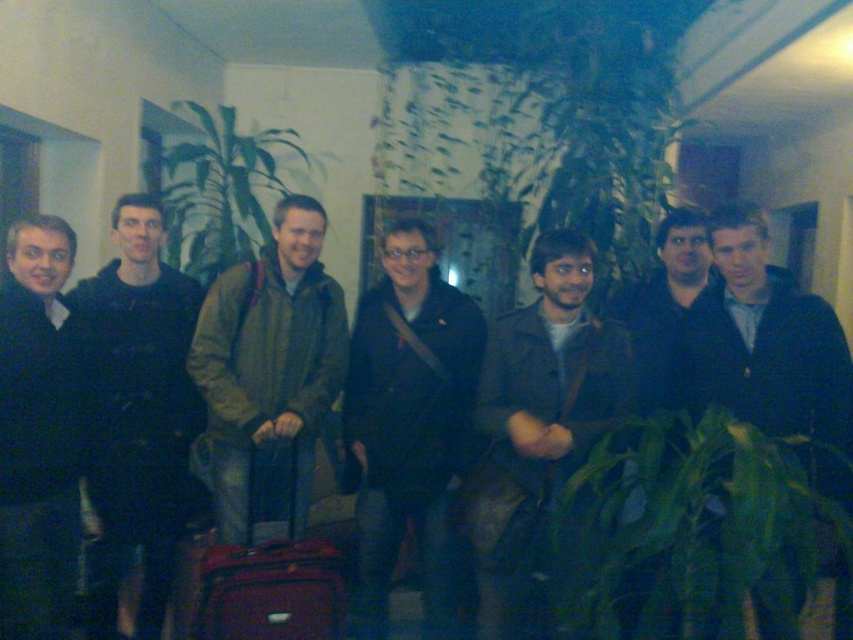
Does brown leather jacket at center have a greater height compared to matte red suitcase at center?

Yes.

Who is positioned more to the left, brown leather jacket at center or matte red suitcase at center?

matte red suitcase at center

Is point (498, 417) closer to viewer compared to point (299, 470)?

Yes, it is in front of point (299, 470).

Locate an element on the screen. brown leather jacket at center is located at coordinates (537, 426).

Is dark blue fabric jacket at center bigger than black matte sweater at left?

Yes, dark blue fabric jacket at center is bigger than black matte sweater at left.

Is point (105, 528) behind point (39, 356)?

Yes, it is.

I want to click on dark blue fabric jacket at center, so click(x=138, y=417).

Between point (576, 275) and point (828, 580), which one is positioned behind?

The point (828, 580) is behind.

Between point (498, 442) and point (750, 378), which one is positioned in front?

Point (750, 378) is in front.

This screenshot has height=640, width=853. I want to click on brown leather jacket at center, so click(x=537, y=426).